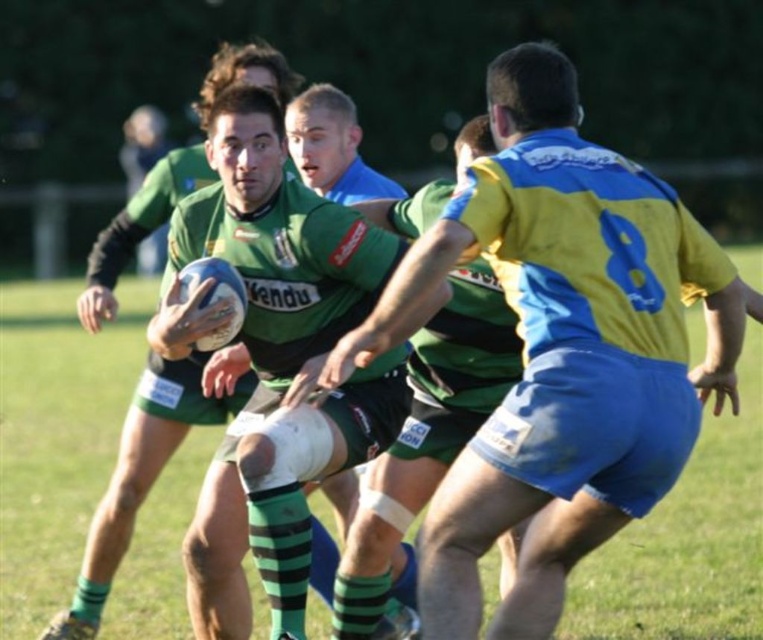
Question: Does yellow-blue jersey at right have a larger size compared to green matte jersey at center?

Choices:
 (A) no
 (B) yes

Answer: (B)

Question: Can you confirm if yellow-blue jersey at right is thinner than green matte jersey at center?

Choices:
 (A) yes
 (B) no

Answer: (B)

Question: Among these objects, which one is farthest from the camera?

Choices:
 (A) green matte jersey at center
 (B) yellow-blue jersey at right

Answer: (A)

Question: Which point is closer to the camera?

Choices:
 (A) (403, 584)
 (B) (497, 124)

Answer: (B)

Question: Does yellow-blue jersey at right have a lesser width compared to green matte jersey at center?

Choices:
 (A) no
 (B) yes

Answer: (A)